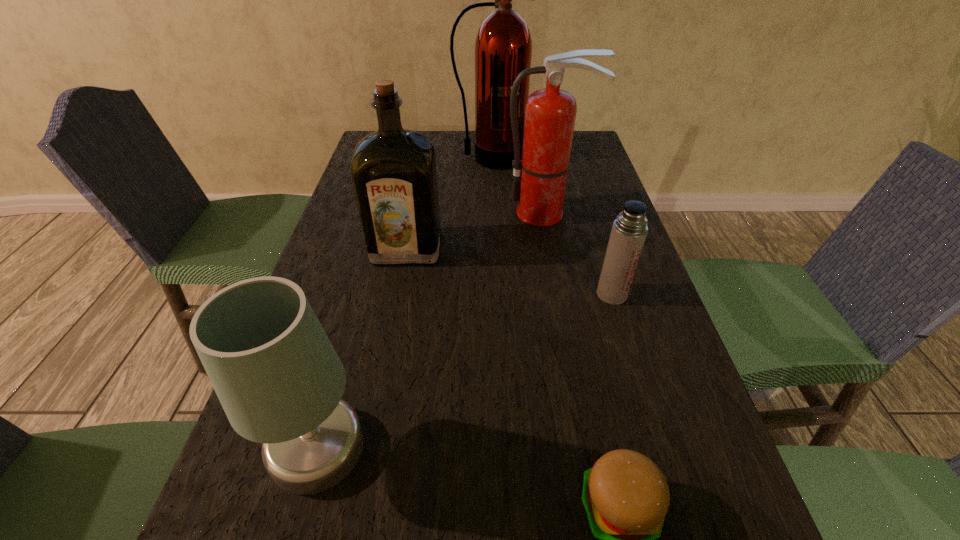
Where is `free region located 0.190m on the label of the liquor`? The height and width of the screenshot is (540, 960). free region located 0.190m on the label of the liquor is located at coordinates (392, 329).

Where is `vacant region located on the base of the fourth tallest object`? This screenshot has height=540, width=960. vacant region located on the base of the fourth tallest object is located at coordinates (511, 447).

This screenshot has width=960, height=540. What are the coordinates of `vacant area situated on the front of the fifth tallest object` in the screenshot? It's located at (648, 414).

Find the location of a particular element. object situated at the far edge is located at coordinates (503, 47).

You are a GUI agent. You are given a task and a screenshot of the screen. Output one action in this format:
    pyautogui.click(x=<x>, y=<y>)
    Task: Click on the liquor that is at the left edge
    This screenshot has height=540, width=960.
    Given the screenshot: What is the action you would take?
    pyautogui.click(x=394, y=174)

You are a GUI agent. You are given a task and a screenshot of the screen. Output one action in this format:
    pyautogui.click(x=<x>, y=<y>)
    Task: Click on the lampshade located at the left edge
    
    Given the screenshot: What is the action you would take?
    pyautogui.click(x=277, y=376)

Find the location of `fire extinguisher that is at the right edge`. fire extinguisher that is at the right edge is located at coordinates (540, 177).

Identify the location of thermos bottle situated at the right edge. (629, 231).

Locate an element on the screen. The width and height of the screenshot is (960, 540). free space at the far edge of the desktop is located at coordinates (448, 139).

Where is `free space at the left edge of the desktop`? The height and width of the screenshot is (540, 960). free space at the left edge of the desktop is located at coordinates (347, 337).